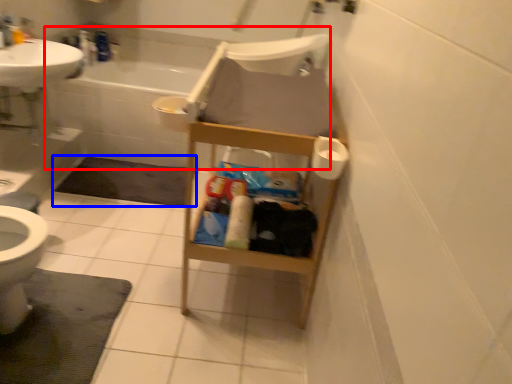
Question: Among these objects, which one is nearest to the camera, bath (highlighted by a red box) or bath mat (highlighted by a blue box)?

Choices:
 (A) bath
 (B) bath mat

Answer: (B)